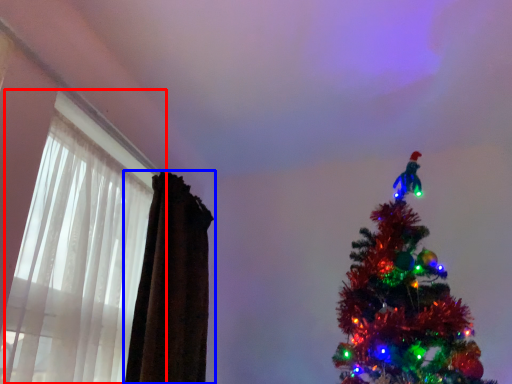
Question: Which object is further to the camera taking this photo, window (highlighted by a red box) or curtain (highlighted by a blue box)?

Choices:
 (A) window
 (B) curtain

Answer: (B)